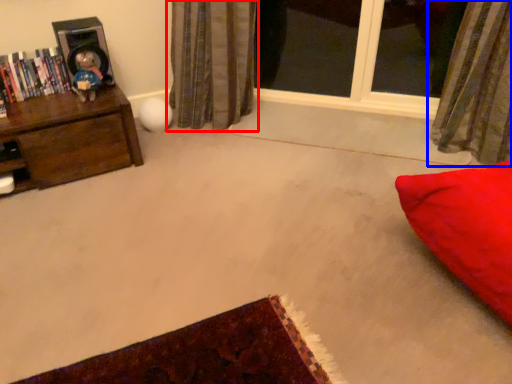
Question: Which point is further to the camera, curtain (highlighted by a red box) or curtain (highlighted by a blue box)?

Choices:
 (A) curtain
 (B) curtain

Answer: (A)